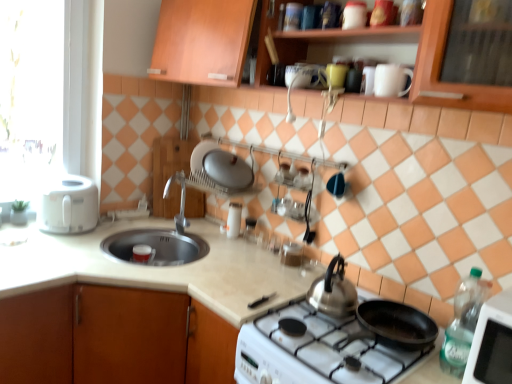
Question: Considering the relative sizes of white plastic toaster at left and beige laminate countertop at center, which is the second countertop from right to left, in the image provided, is white plastic toaster at left bigger than beige laminate countertop at center, which is the second countertop from right to left,?

Choices:
 (A) no
 (B) yes

Answer: (A)

Question: Are white plastic toaster at left and beige laminate countertop at center, placed as the 1th countertop when sorted from left to right, located far from each other?

Choices:
 (A) yes
 (B) no

Answer: (B)

Question: Can you confirm if white plastic toaster at left is positioned to the right of beige laminate countertop at center, which is the second countertop from right to left?

Choices:
 (A) no
 (B) yes

Answer: (A)

Question: Is white plastic toaster at left to the left of beige laminate countertop at center, which is the second countertop from right to left, from the viewer's perspective?

Choices:
 (A) no
 (B) yes

Answer: (B)

Question: From a real-world perspective, is white plastic toaster at left on top of beige laminate countertop at center, which is the second countertop from right to left?

Choices:
 (A) yes
 (B) no

Answer: (A)

Question: From their relative heights in the image, would you say beige laminate countertop at center, which is the second countertop from right to left, is taller or shorter than glossy ceramic mug at upper center, the 2th mug in the front-to-back sequence?

Choices:
 (A) tall
 (B) short

Answer: (A)

Question: Is beige laminate countertop at center, placed as the 1th countertop when sorted from left to right, wider or thinner than glossy ceramic mug at upper center, the second mug viewed from the right?

Choices:
 (A) wide
 (B) thin

Answer: (A)

Question: Do you think beige laminate countertop at center, which is the second countertop from right to left, is within glossy ceramic mug at upper center, the first mug from the top, or outside of it?

Choices:
 (A) outside
 (B) inside

Answer: (A)

Question: From a real-world perspective, is beige laminate countertop at center, which is the second countertop from right to left, above or below glossy ceramic mug at upper center, the 2th mug from the bottom?

Choices:
 (A) above
 (B) below

Answer: (B)

Question: In terms of height, does silver metallic faucet at center look taller or shorter compared to white glossy cup at upper center, arranged as the first appliance when viewed from the right?

Choices:
 (A) tall
 (B) short

Answer: (A)

Question: Relative to white glossy cup at upper center, the 2th appliance positioned from the top, is silver metallic faucet at center in front or behind?

Choices:
 (A) behind
 (B) front

Answer: (A)

Question: In terms of width, does silver metallic faucet at center look wider or thinner when compared to white glossy cup at upper center, the 4th appliance positioned from the left?

Choices:
 (A) wide
 (B) thin

Answer: (A)

Question: From the image's perspective, is silver metallic faucet at center above or below white glossy cup at upper center, the 2th appliance positioned from the top?

Choices:
 (A) below
 (B) above

Answer: (A)

Question: From a real-world perspective, relative to metallic silver canister at upper center, positioned as the fourth appliance in bottom-to-top order, is white matte mug at upper center, positioned as the 2th mug in top-to-bottom order, vertically above or below?

Choices:
 (A) above
 (B) below

Answer: (B)

Question: From the image's perspective, is white matte mug at upper center, placed as the 1th mug when sorted from right to left, positioned above or below metallic silver canister at upper center, the 2th appliance positioned from the front?

Choices:
 (A) below
 (B) above

Answer: (A)